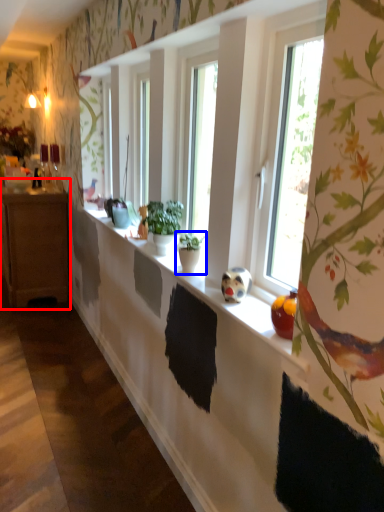
Question: Which point is closer to the camera, cabinetry (highlighted by a red box) or houseplant (highlighted by a blue box)?

Choices:
 (A) cabinetry
 (B) houseplant

Answer: (B)